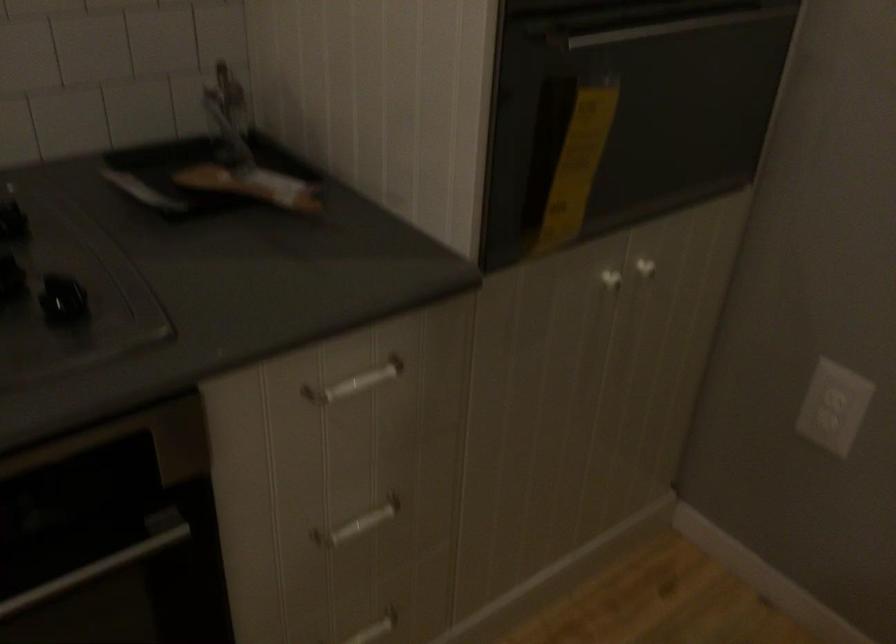
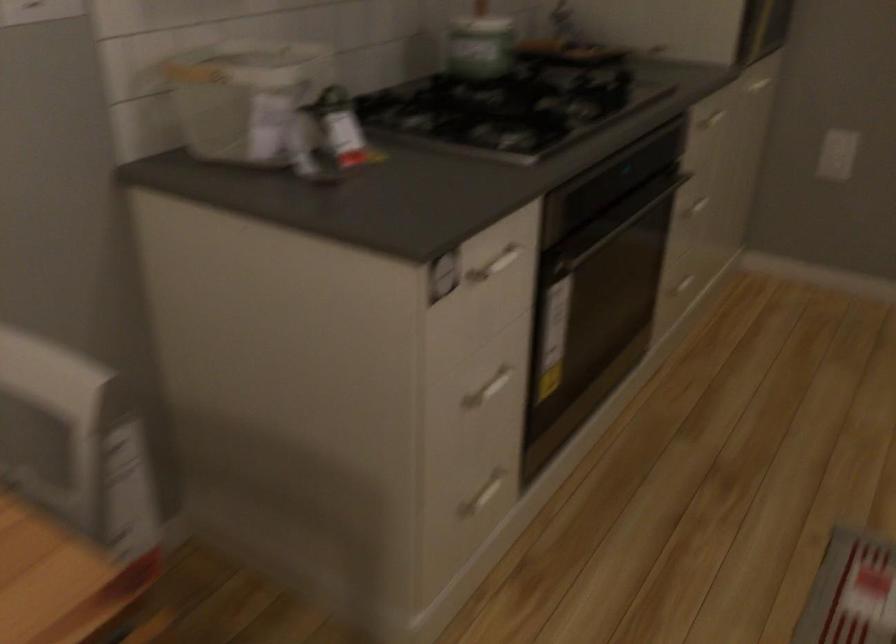
Question: I am providing you with two images of the same scene from different viewpoints. Please identify which objects are invisible in image2.

Choices:
 (A) oven door handle
 (B) white cabinet handle
 (C) white drawer handle
 (D) none of these

Answer: (D)